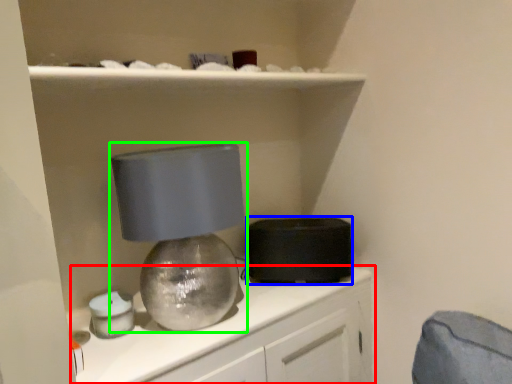
Question: Estimate the real-world distances between objects in this image. Which object is closer to cabinetry (highlighted by a red box), appliance (highlighted by a blue box) or lamp (highlighted by a green box)?

Choices:
 (A) appliance
 (B) lamp

Answer: (A)